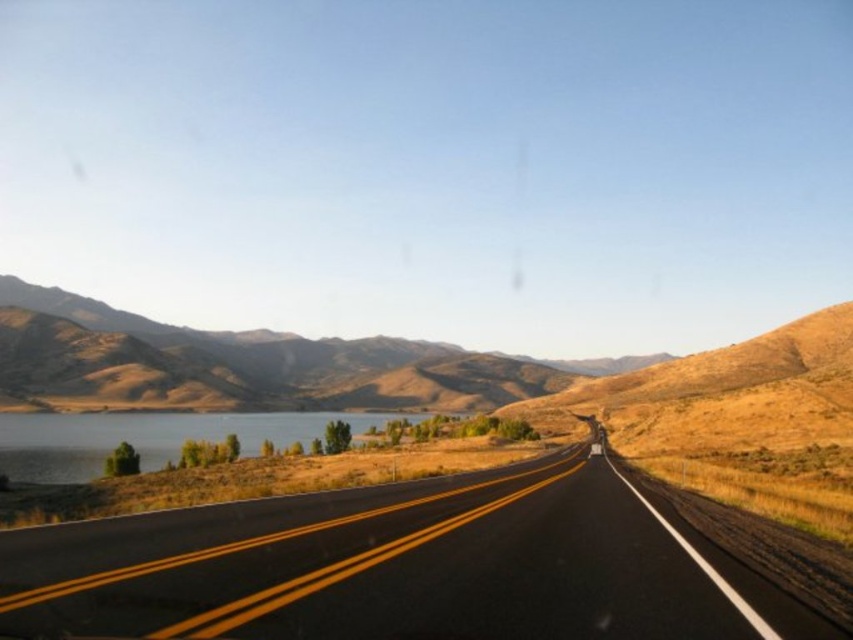
You are driving a car that is 1.8 meters tall. As you approach the brown textured hill at left and the shiny blue water at left, which object will you first encounter that is taller than your car?

A: The brown textured hill at left has a greater height compared to shiny blue water at left. Since the brown textured hill at left is taller than the shiny blue water at left, and the car is 1.8 meters tall, you will first encounter the brown textured hill at left as it is taller than your car.

You are driving a car and need to determine the distance between the black asphalt highway at center and the shiny blue water at left. Which one is nearer to your current position?

The black asphalt highway at center is closer to the viewer than the shiny blue water at left, so it is nearer to your current position.